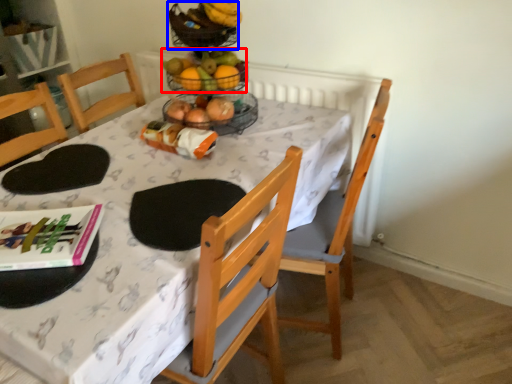
Question: Which point is closer to the camera, grapefruit (highlighted by a red box) or basket (highlighted by a blue box)?

Choices:
 (A) grapefruit
 (B) basket

Answer: (B)